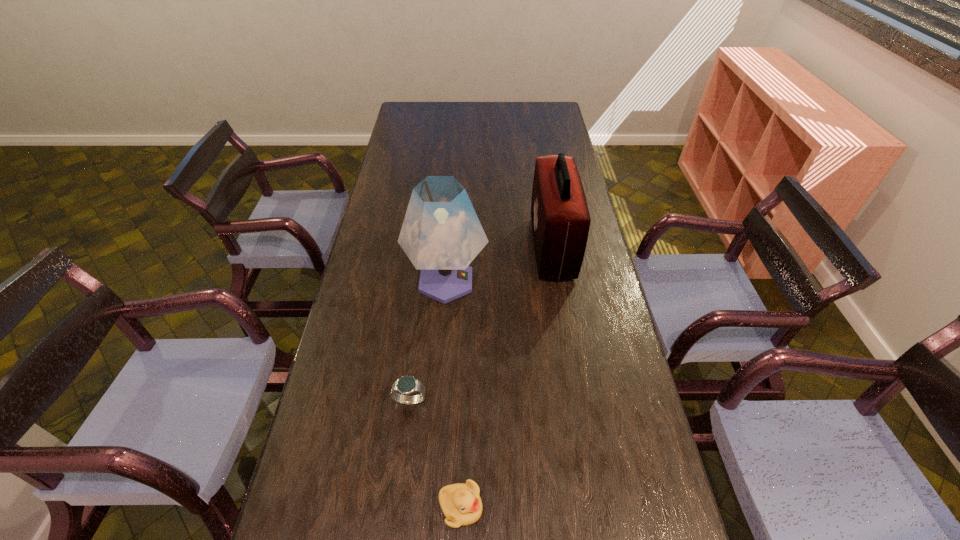
Where is `object situated at the right edge`? object situated at the right edge is located at coordinates (560, 218).

Find the location of `free space at the far edge of the desktop`. free space at the far edge of the desktop is located at coordinates (505, 120).

This screenshot has height=540, width=960. What are the coordinates of `vacant space at the left edge of the desktop` in the screenshot? It's located at (371, 224).

I want to click on free space at the right edge, so click(561, 134).

The width and height of the screenshot is (960, 540). I want to click on free region at the far right corner, so click(557, 112).

Where is `vacant area that lies between the duckling and the lampshade`? vacant area that lies between the duckling and the lampshade is located at coordinates (453, 394).

At what (x,y) coordinates should I click in order to perform the action: click on free spot between the nearest object and the lampshade. Please return your answer as a coordinate pair (x, y). This screenshot has width=960, height=540. Looking at the image, I should click on (453, 394).

Identify the location of empty space between the first aid kit and the duckling. (506, 377).

Where is `vacant space in between the third farthest object and the lampshade`? vacant space in between the third farthest object and the lampshade is located at coordinates (428, 341).

Where is `vacant area that lies between the second nearest object and the lampshade`? This screenshot has height=540, width=960. vacant area that lies between the second nearest object and the lampshade is located at coordinates (428, 341).